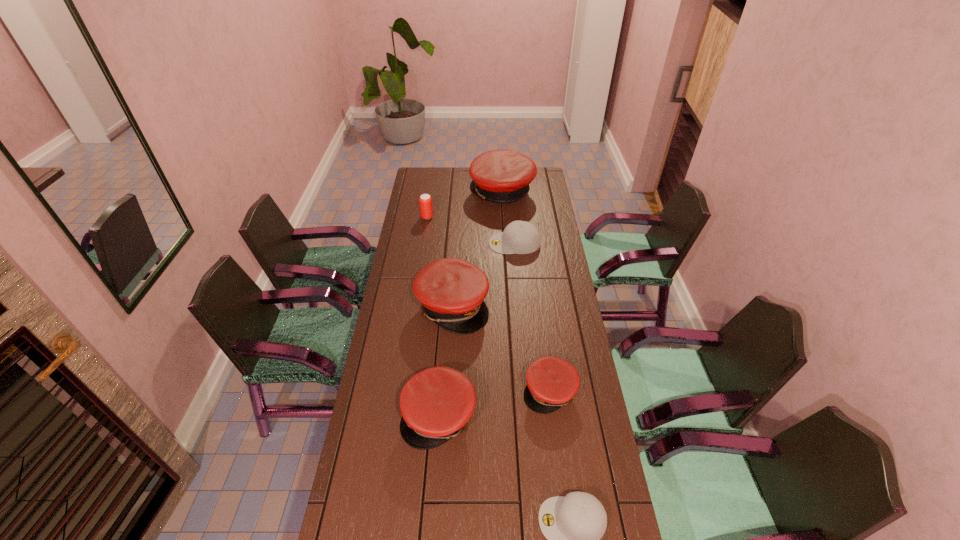
Find the location of a particular element. Image resolution: width=960 pixels, height=540 pixels. empty space between the farthest red cap and the fourth nearest cap is located at coordinates (477, 249).

Where is `vacant area that lies between the smallest red cap and the sixth shortest object`? vacant area that lies between the smallest red cap and the sixth shortest object is located at coordinates (501, 348).

Find the location of a particular element. The height and width of the screenshot is (540, 960). the fourth closest object relative to the smallest red cap is located at coordinates (520, 237).

Select which object appears as the second closest to the smallest red cap. Please provide its 2D coordinates. Your answer should be formatted as a tuple, i.e. [(x, y)], where the tuple contains the x and y coordinates of a point satisfying the conditions above.

[(452, 291)]

Image resolution: width=960 pixels, height=540 pixels. I want to click on cap object that ranks as the third closest to the biggest red cap, so click(x=552, y=382).

Locate an element on the screen. The height and width of the screenshot is (540, 960). cap object that ranks as the fourth closest to the nearest object is located at coordinates (520, 237).

Locate which red cap is the third closest to the smallest red cap. Please provide its 2D coordinates. Your answer should be formatted as a tuple, i.e. [(x, y)], where the tuple contains the x and y coordinates of a point satisfying the conditions above.

[(503, 176)]

Identify which red cap is the third closest to the second smallest red cap. Please provide its 2D coordinates. Your answer should be formatted as a tuple, i.e. [(x, y)], where the tuple contains the x and y coordinates of a point satisfying the conditions above.

[(503, 176)]